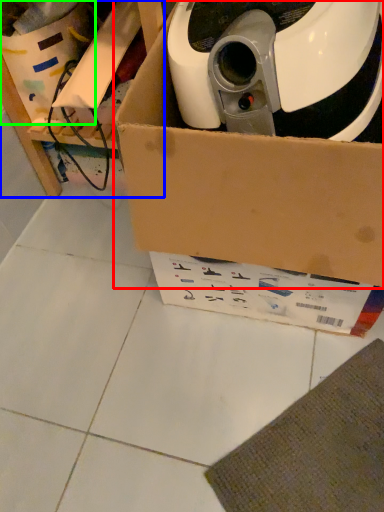
Question: Which is nearer to the box (highlighted by a red box)? furniture (highlighted by a blue box) or storage box (highlighted by a green box).

Choices:
 (A) furniture
 (B) storage box

Answer: (A)